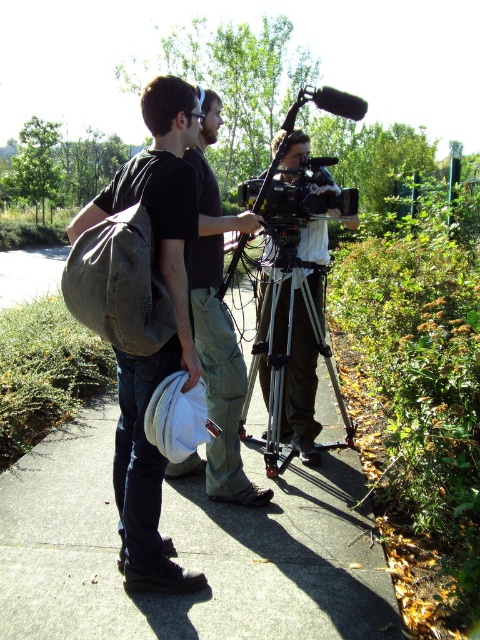
Question: Which object is positioned closest to the concrete at center?

Choices:
 (A) canvas backpack at left
 (B) silver metallic tripod at center
 (C) matte black backpack at center

Answer: (B)

Question: Which of these objects is positioned farthest from the canvas backpack at left?

Choices:
 (A) concrete at center
 (B) silver metallic tripod at center
 (C) matte black backpack at center

Answer: (B)

Question: Can you confirm if concrete at center is positioned to the left of canvas backpack at left?

Choices:
 (A) yes
 (B) no

Answer: (B)

Question: Does matte black backpack at center have a greater width compared to silver metallic tripod at center?

Choices:
 (A) yes
 (B) no

Answer: (B)

Question: Which of the following is the closest to the observer?

Choices:
 (A) (279, 385)
 (B) (88, 477)

Answer: (A)

Question: Is concrete at center to the right of matte black backpack at center from the viewer's perspective?

Choices:
 (A) no
 (B) yes

Answer: (B)